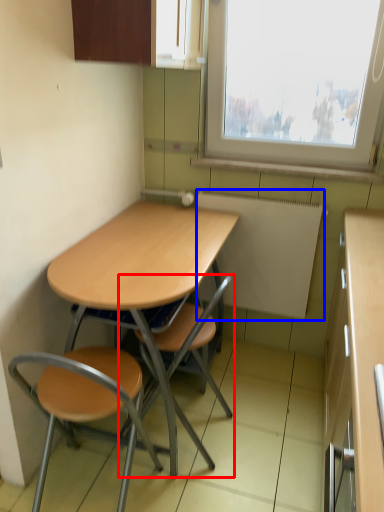
Question: Which point is further to the camera, chair (highlighted by a red box) or appliance (highlighted by a blue box)?

Choices:
 (A) chair
 (B) appliance

Answer: (B)